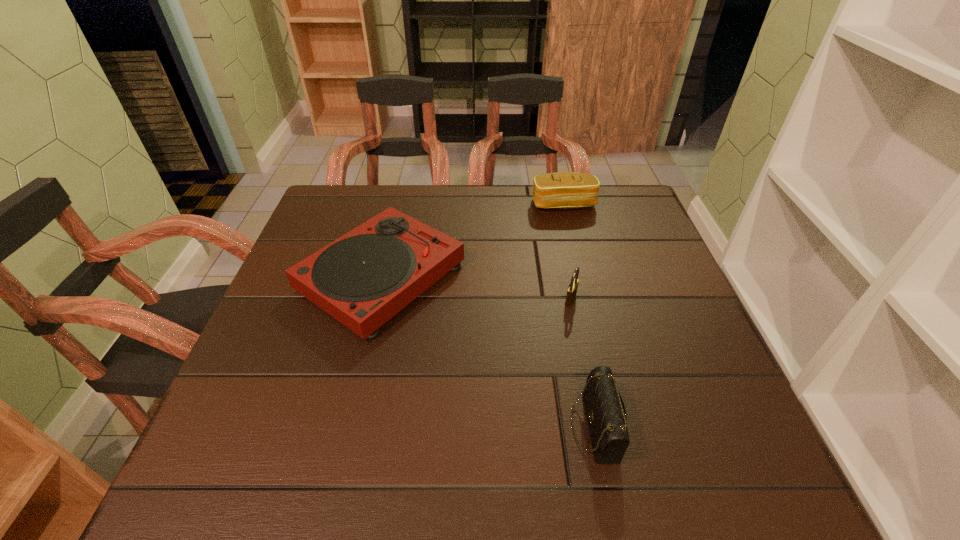
Where is `clutch bag present at the far edge`? clutch bag present at the far edge is located at coordinates (562, 190).

In order to click on record player that is at the far edge in this screenshot , I will do `click(362, 279)`.

At what (x,y) coordinates should I click in order to perform the action: click on object located in the near edge section of the desktop. Please return your answer as a coordinate pair (x, y). Looking at the image, I should click on (606, 415).

Find the location of a particular element. object that is at the left edge is located at coordinates (362, 279).

The width and height of the screenshot is (960, 540). In order to click on object that is at the right edge in this screenshot , I will do `click(562, 190)`.

What are the coordinates of `object located at the far left corner` in the screenshot? It's located at (362, 279).

Find the location of a particular element. The image size is (960, 540). object present at the far right corner is located at coordinates (562, 190).

The height and width of the screenshot is (540, 960). Find the location of `free space at the far edge of the desktop`. free space at the far edge of the desktop is located at coordinates (543, 228).

In order to click on vacant area at the near edge of the desktop in this screenshot , I will do `click(390, 461)`.

Image resolution: width=960 pixels, height=540 pixels. Find the location of `free location at the left edge of the desktop`. free location at the left edge of the desktop is located at coordinates (286, 381).